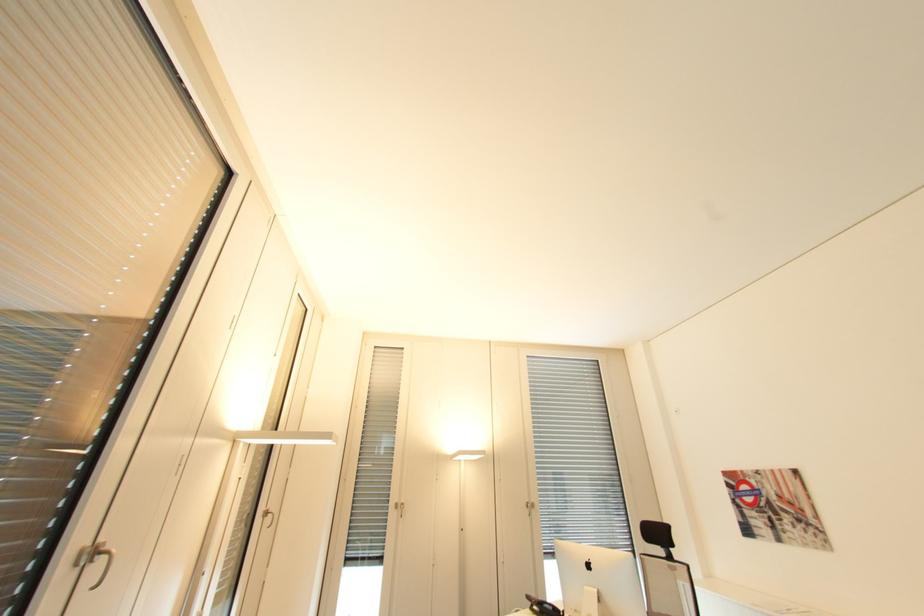
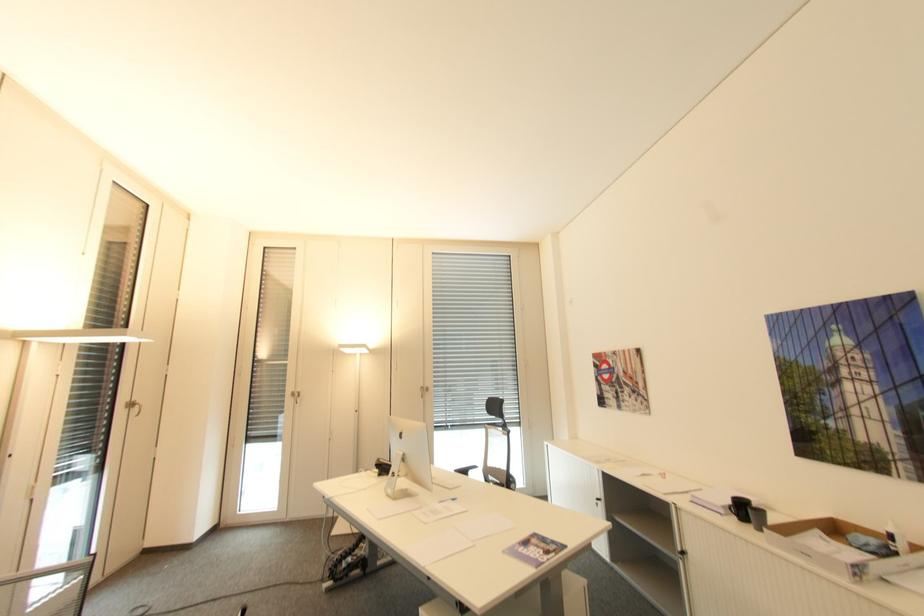
Locate, in the second image, the point that corresponds to the point at 531,501 in the first image.

(427, 387)